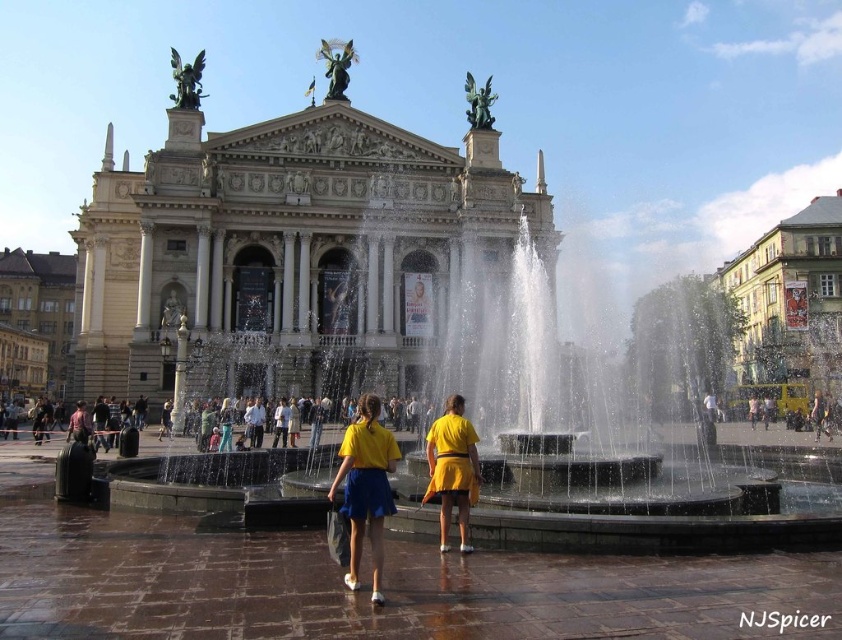
Question: Which of the following is the closest to the observer?

Choices:
 (A) yellow matte shorts at center
 (B) yellow matte skirt at center

Answer: (B)

Question: Is yellow matte skirt at center closer to camera compared to yellow matte shorts at center?

Choices:
 (A) yes
 (B) no

Answer: (A)

Question: Can you confirm if yellow matte skirt at center is positioned to the right of yellow matte shorts at center?

Choices:
 (A) yes
 (B) no

Answer: (B)

Question: Can you confirm if yellow matte skirt at center is positioned below yellow matte shorts at center?

Choices:
 (A) yes
 (B) no

Answer: (A)

Question: Which point is closer to the camera?

Choices:
 (A) (350, 474)
 (B) (449, 404)

Answer: (A)